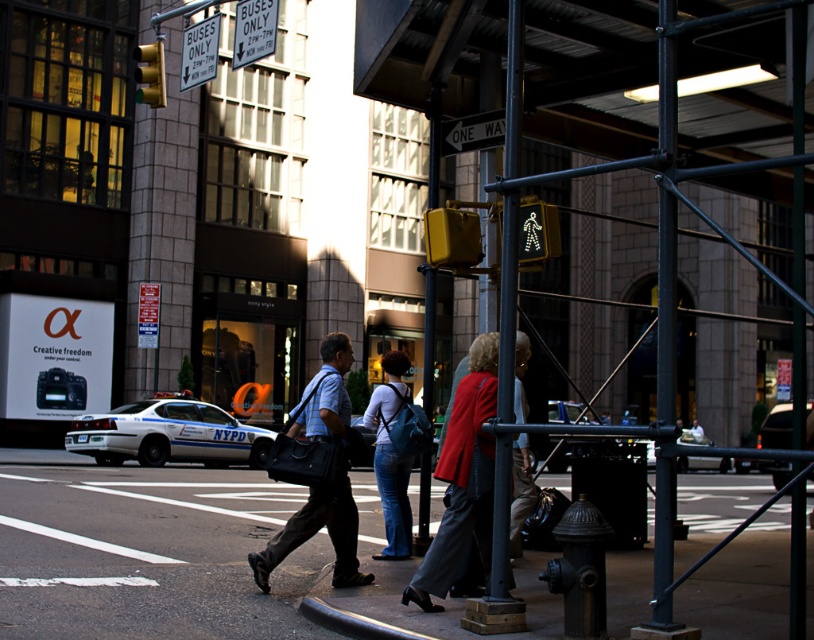
You are a delivery person standing at the crosswalk in the scene. You need to deliver a package to the location marked by point (449, 484) and then to point (668, 298). Which location should you visit first to minimize backtracking?

You should visit point (449, 484) first because it is closer to you than point (668, 298). Since it is further to the viewer, you can reach it without needing to backtrack after delivering to the second point.

You are a delivery person holding the matte black bag at center and need to place it against the black metal pole at center. Can you easily move the bag to the pole without moving the pole?

The black metal pole at center is positioned on the right side of the matte black bag at center, so you can move the matte black bag at center to the right to place it against the black metal pole at center without needing to move the pole.

You are a delivery person with a 1.2 meter wide cart. You need to navigate through the space between the black metal pole at center and the matte black bag at center. Can your cart fit through the gap between them?

The gap between the black metal pole at center and the matte black bag at center is 3.11 meters. Since the cart is 1.2 meters wide, it can easily pass through the gap as the space is wider than the cart.